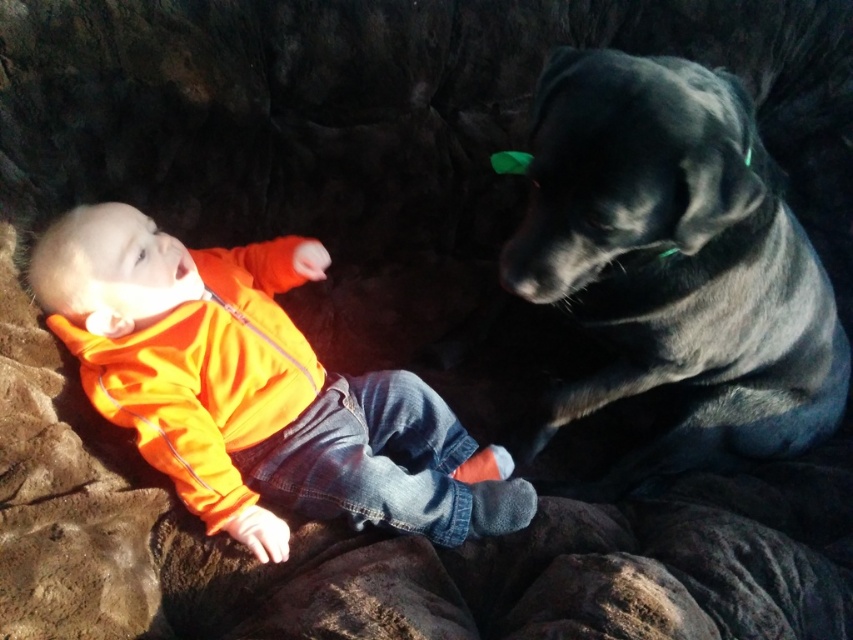
In the scene shown: You are a photographer trying to capture a closeup of the shiny black fur at upper right and the orange fleece jacket at upper left. Since you can only focus on one subject at a time, which one should you choose to ensure the other is still in the background?

You should focus on the shiny black fur at upper right because it is in front of the orange fleece jacket at upper left, so the orange fleece jacket at upper left will remain in the background.